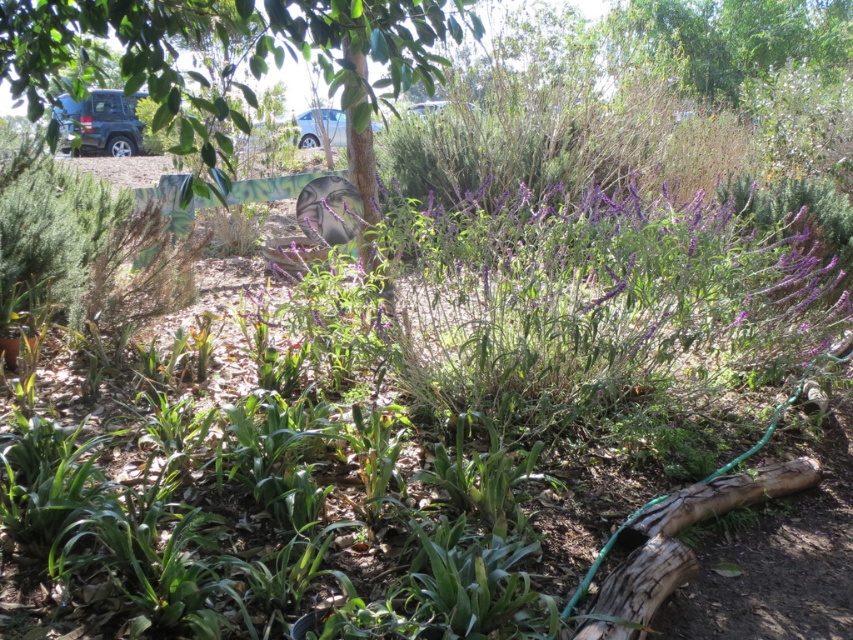
Does green leafy tree at center have a larger size compared to green leafy plant at lower left?

Correct, green leafy tree at center is larger in size than green leafy plant at lower left.

Is green leafy tree at center to the left of green leafy plant at lower left from the viewer's perspective?

In fact, green leafy tree at center is to the right of green leafy plant at lower left.

Does point (49, 90) lie in front of point (27, 336)?

Yes.

The height and width of the screenshot is (640, 853). I want to click on green leafy tree at center, so click(242, 54).